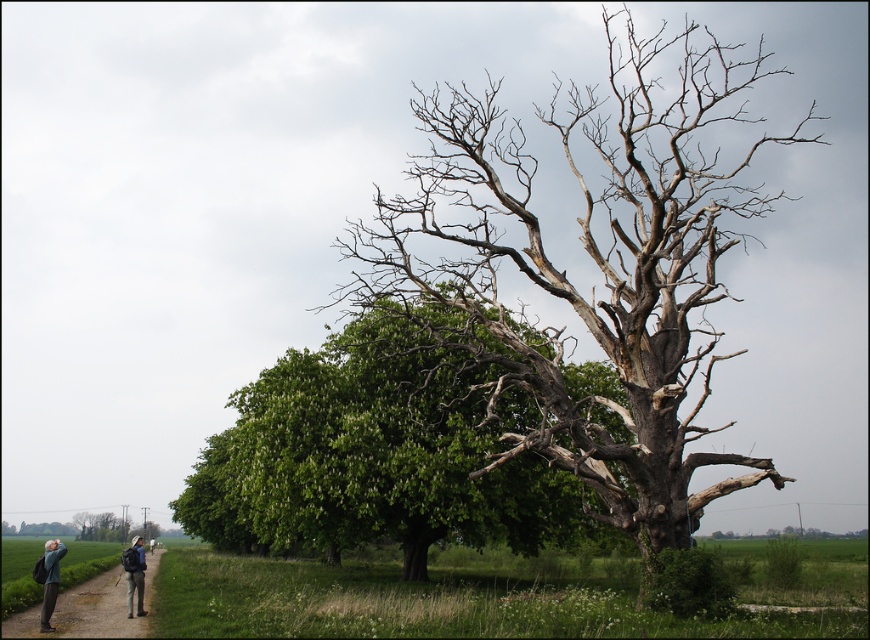
Question: Is bare wood tree at center bigger than green leafy tree at center?

Choices:
 (A) no
 (B) yes

Answer: (B)

Question: Which point is closer to the camera?

Choices:
 (A) green fabric jacket at lower left
 (B) dark gray backpack at lower left
 (C) bare wood tree at center

Answer: (B)

Question: Where is bare wood tree at center located in relation to green fabric jacket at lower left in the image?

Choices:
 (A) above
 (B) below

Answer: (A)

Question: Estimate the real-world distances between objects in this image. Which object is farther from the green fabric jacket at lower left?

Choices:
 (A) green leafy tree at center
 (B) dark gray backpack at lower left
 (C) dark blue backpack at lower left
 (D) bare wood tree at center

Answer: (D)

Question: Estimate the real-world distances between objects in this image. Which object is farther from the green fabric jacket at lower left?

Choices:
 (A) bare wood tree at center
 (B) green leafy tree at center

Answer: (A)

Question: Does green leafy tree at center have a larger size compared to dark gray backpack at lower left?

Choices:
 (A) yes
 (B) no

Answer: (A)